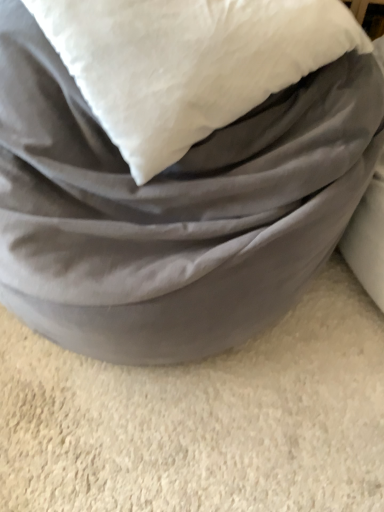
Question: Is point (74, 234) positioned closer to the camera than point (226, 55)?

Choices:
 (A) closer
 (B) farther

Answer: (B)

Question: Relative to white soft pillow at upper center, is matte gray bean bag at center in front or behind?

Choices:
 (A) behind
 (B) front

Answer: (B)

Question: From the image's perspective, is matte gray bean bag at center above or below white soft pillow at upper center?

Choices:
 (A) above
 (B) below

Answer: (B)

Question: Do you think white soft pillow at upper center is within matte gray bean bag at center, or outside of it?

Choices:
 (A) outside
 (B) inside

Answer: (B)

Question: From a real-world perspective, relative to matte gray bean bag at center, is white soft pillow at upper center vertically above or below?

Choices:
 (A) below
 (B) above

Answer: (B)

Question: Is white soft pillow at upper center to the left or to the right of matte gray bean bag at center in the image?

Choices:
 (A) left
 (B) right

Answer: (B)

Question: Considering the positions of white soft pillow at upper center and matte gray bean bag at center in the image, is white soft pillow at upper center bigger or smaller than matte gray bean bag at center?

Choices:
 (A) small
 (B) big

Answer: (A)